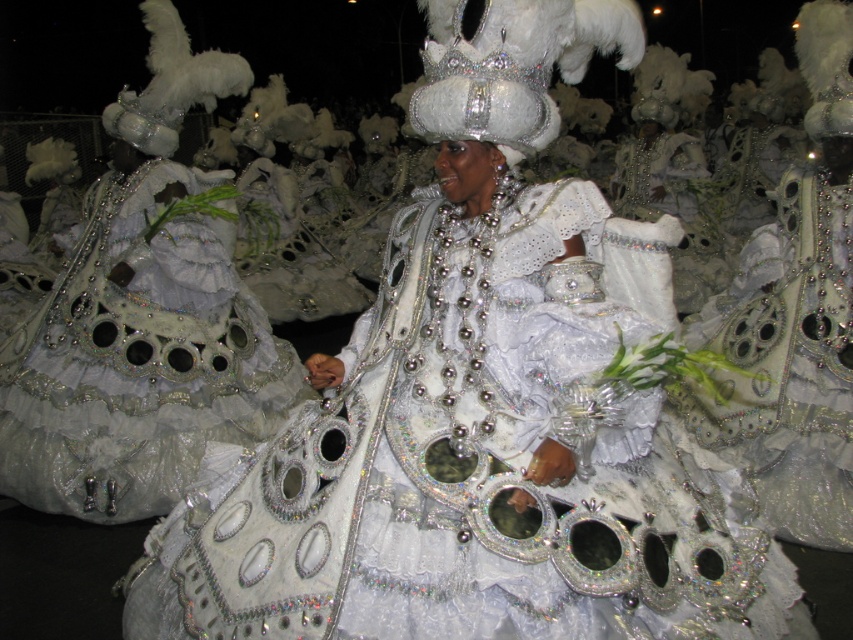
Does shiny silver gown at center lie in front of sparkly silver dress at center?

No, shiny silver gown at center is behind sparkly silver dress at center.

You are a GUI agent. You are given a task and a screenshot of the screen. Output one action in this format:
    pyautogui.click(x=<x>, y=<y>)
    Task: Click on the shiny silver gown at center
    
    Given the screenshot: What is the action you would take?
    pyautogui.click(x=142, y=317)

Does glittery white dress at center appear on the right side of sparkly silver dress at center?

No, glittery white dress at center is not to the right of sparkly silver dress at center.

Identify the location of glittery white dress at center. The height and width of the screenshot is (640, 853). (479, 461).

At what (x,y) coordinates should I click in order to perform the action: click on glittery white dress at center. Please return your answer as a coordinate pair (x, y). Image resolution: width=853 pixels, height=640 pixels. Looking at the image, I should click on (479, 461).

Can you confirm if shiny silver gown at center is smaller than white sequined crown at center?

Actually, shiny silver gown at center might be larger than white sequined crown at center.

Is shiny silver gown at center bigger than white sequined crown at center?

Correct, shiny silver gown at center is larger in size than white sequined crown at center.

Locate an element on the screen. shiny silver gown at center is located at coordinates [142, 317].